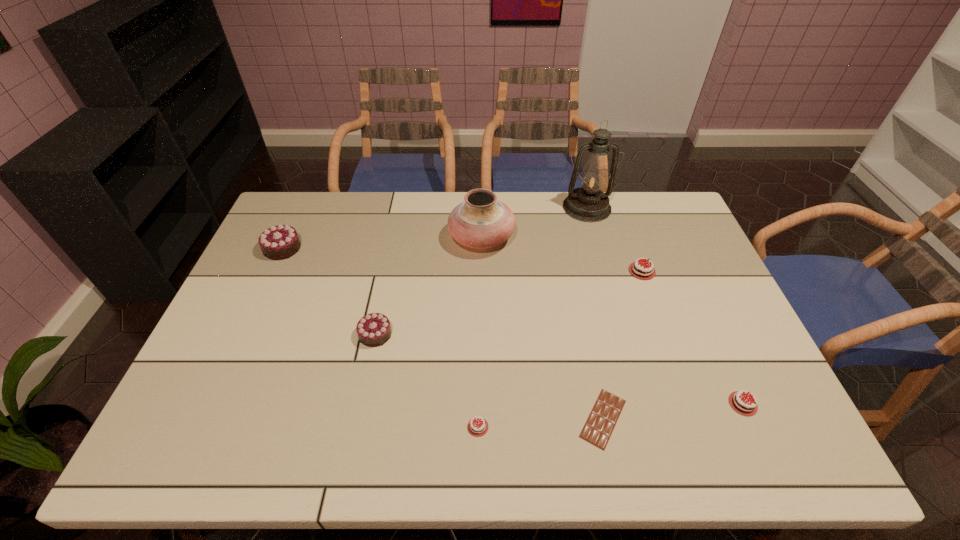
Where is `free space located 0.370m on the left of the third chocolate cake from left to right`? This screenshot has width=960, height=540. free space located 0.370m on the left of the third chocolate cake from left to right is located at coordinates (292, 427).

The image size is (960, 540). I want to click on vacant space situated on the right of the chocolate bar, so click(x=677, y=418).

Where is `oil lamp that is positioned at the far edge`? This screenshot has height=540, width=960. oil lamp that is positioned at the far edge is located at coordinates (588, 203).

Identify the location of pottery present at the far edge. (481, 221).

You are a GUI agent. You are given a task and a screenshot of the screen. Output one action in this format:
    pyautogui.click(x=<x>, y=<y>)
    Task: Click on the chocolate bar that is at the near edge
    
    Given the screenshot: What is the action you would take?
    pyautogui.click(x=604, y=415)

I want to click on object located at the left edge, so click(x=279, y=242).

Image resolution: width=960 pixels, height=540 pixels. Identify the location of object located in the near right corner section of the desktop. (741, 404).

Identify the location of vacant space at the far edge of the desktop. (424, 226).

Identify the location of blank space at the near edge of the desktop. The image size is (960, 540). (580, 430).

The width and height of the screenshot is (960, 540). Identify the location of free spot at the left edge of the desktop. (256, 307).